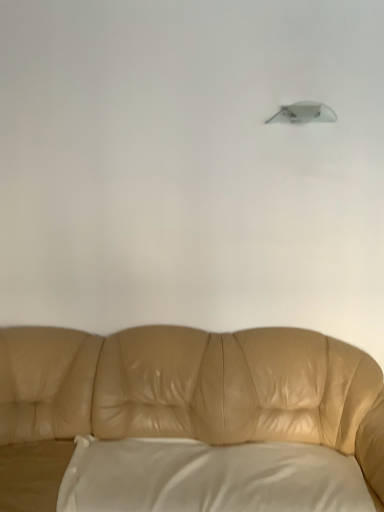
Question: Does white satin pillow at lower center lie in front of satin gray lampshade at upper center?

Choices:
 (A) yes
 (B) no

Answer: (A)

Question: Is white satin pillow at lower center smaller than satin gray lampshade at upper center?

Choices:
 (A) no
 (B) yes

Answer: (A)

Question: Is white satin pillow at lower center at the right side of satin gray lampshade at upper center?

Choices:
 (A) no
 (B) yes

Answer: (A)

Question: Is white satin pillow at lower center not within satin gray lampshade at upper center?

Choices:
 (A) no
 (B) yes

Answer: (B)

Question: From a real-world perspective, is white satin pillow at lower center on top of satin gray lampshade at upper center?

Choices:
 (A) no
 (B) yes

Answer: (A)

Question: Would you say tan leather couch at center is to the left or to the right of white satin pillow at lower center in the picture?

Choices:
 (A) left
 (B) right

Answer: (A)

Question: Is tan leather couch at center situated inside white satin pillow at lower center or outside?

Choices:
 (A) inside
 (B) outside

Answer: (B)

Question: From the image's perspective, is tan leather couch at center above or below white satin pillow at lower center?

Choices:
 (A) above
 (B) below

Answer: (A)

Question: Based on their sizes in the image, would you say tan leather couch at center is bigger or smaller than white satin pillow at lower center?

Choices:
 (A) big
 (B) small

Answer: (A)

Question: Is satin gray lampshade at upper center spatially inside tan leather couch at center, or outside of it?

Choices:
 (A) inside
 (B) outside

Answer: (B)

Question: Relative to tan leather couch at center, is satin gray lampshade at upper center in front or behind?

Choices:
 (A) front
 (B) behind

Answer: (B)

Question: Is point (291, 116) positioned closer to the camera than point (198, 402)?

Choices:
 (A) closer
 (B) farther

Answer: (B)

Question: Based on their positions, is satin gray lampshade at upper center located to the left or right of tan leather couch at center?

Choices:
 (A) right
 (B) left

Answer: (A)

Question: In terms of width, does white satin pillow at lower center look wider or thinner when compared to satin gray lampshade at upper center?

Choices:
 (A) thin
 (B) wide

Answer: (B)

Question: Is white satin pillow at lower center to the left or to the right of satin gray lampshade at upper center in the image?

Choices:
 (A) left
 (B) right

Answer: (A)